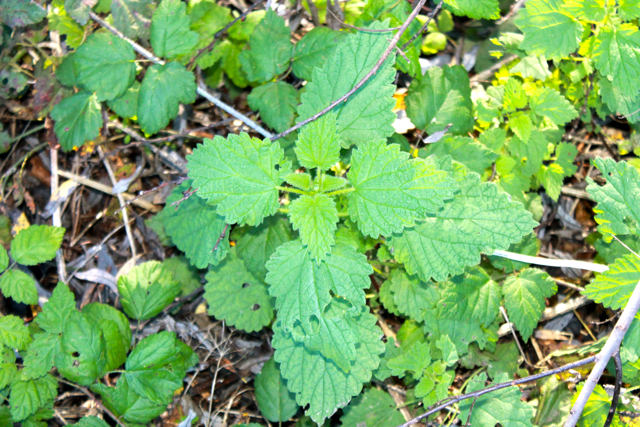
Locate an element on the screen. light is located at coordinates (572, 61).